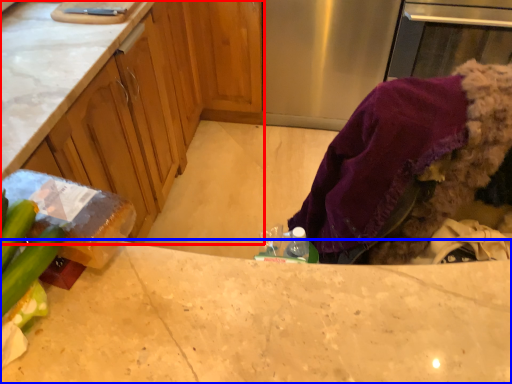
Question: Which of the following is the farthest to the observer, cabinetry (highlighted by a red box) or countertop (highlighted by a blue box)?

Choices:
 (A) cabinetry
 (B) countertop

Answer: (A)